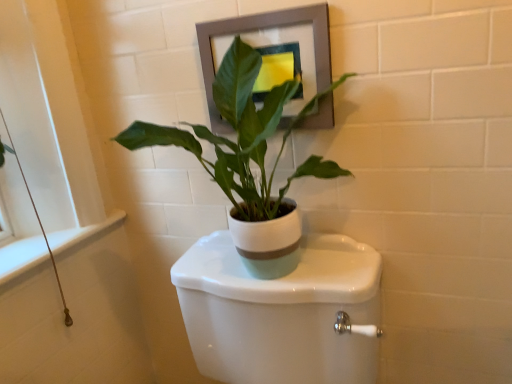
Question: Would you say white glossy toilet at center is inside or outside matte gray picture frame at upper center?

Choices:
 (A) inside
 (B) outside

Answer: (B)

Question: Is white glossy toilet at center taller or shorter than matte gray picture frame at upper center?

Choices:
 (A) tall
 (B) short

Answer: (A)

Question: Which of these objects is positioned closest to the white glossy toilet at center?

Choices:
 (A) matte gray picture frame at upper center
 (B) white matte pot at center

Answer: (B)

Question: Estimate the real-world distances between objects in this image. Which object is farther from the white matte pot at center?

Choices:
 (A) white glossy toilet at center
 (B) matte gray picture frame at upper center

Answer: (A)